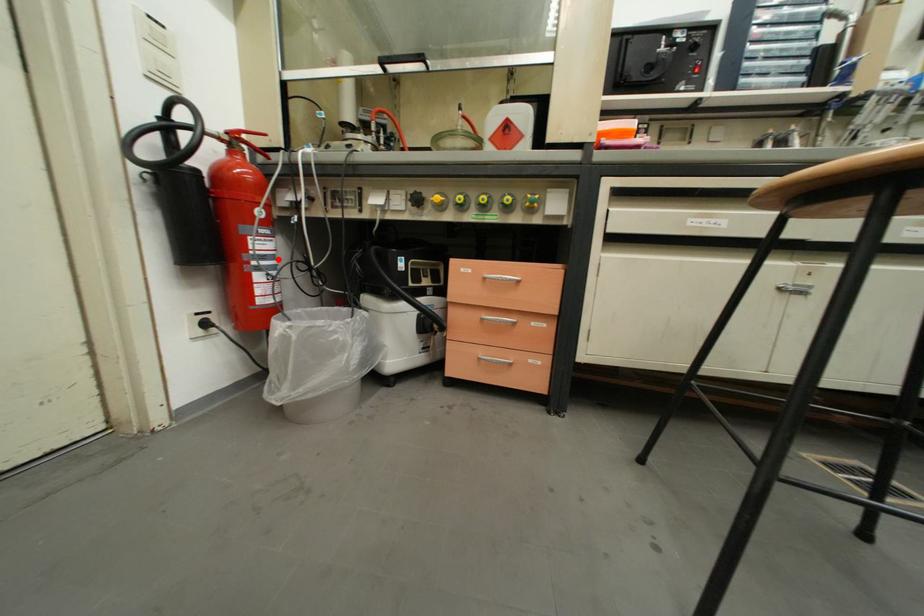
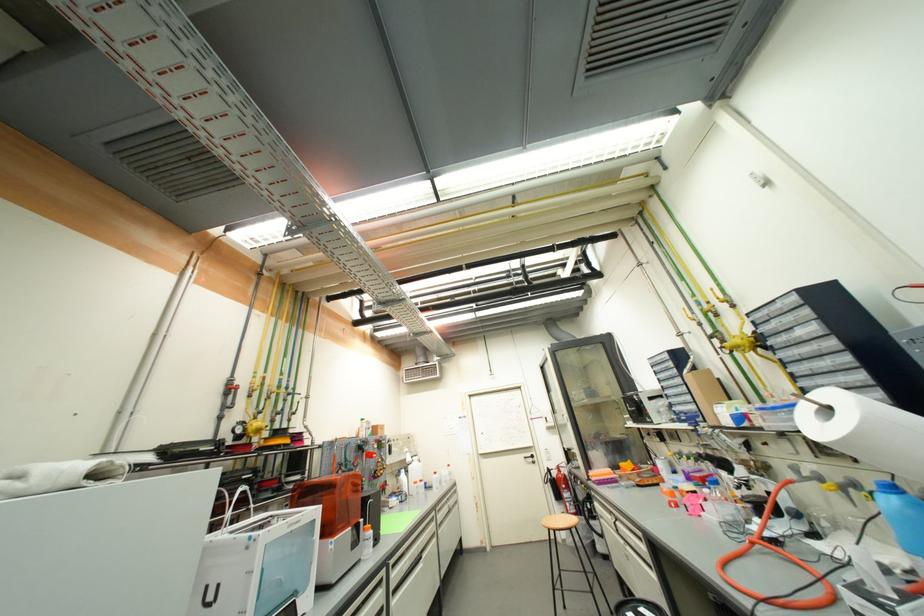
The point at the highlighted location is marked in the first image. Where is the corresponding point in the second image?

(575, 500)